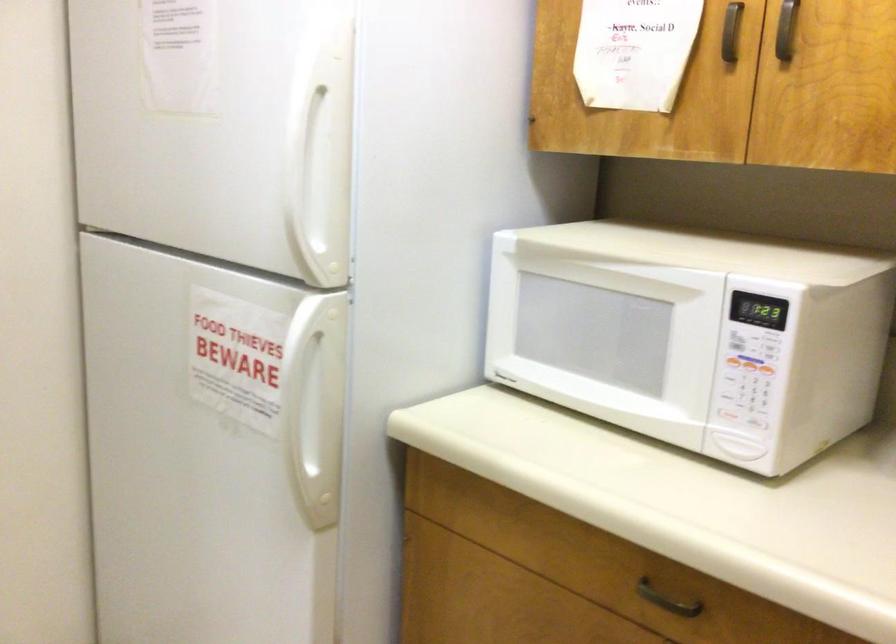
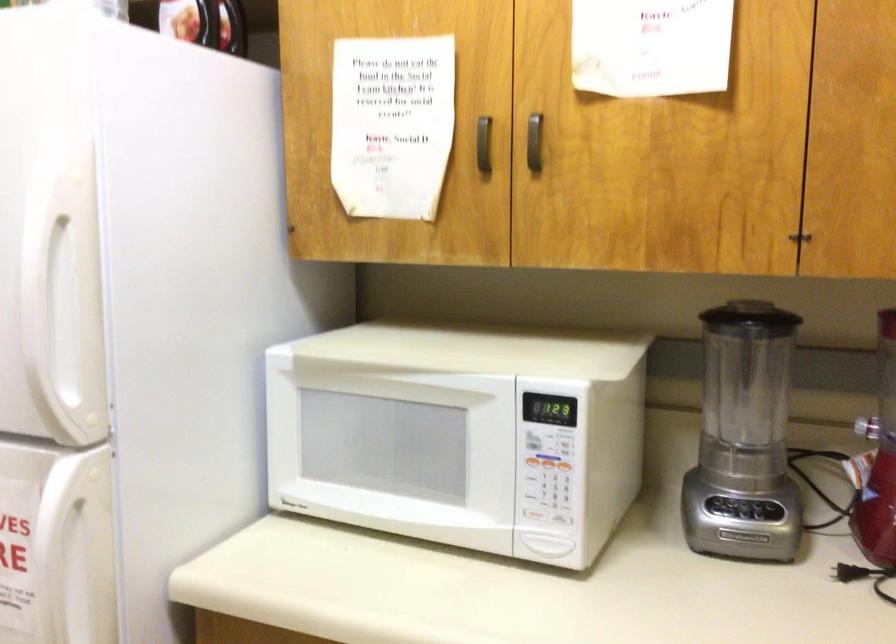
Question: I am providing you with two images of the same scene from different viewpoints. Which of the following objects are not visible in image2?

Choices:
 (A) black blender lid
 (B) blender jar
 (C) microwave keypad button
 (D) none of these

Answer: (D)